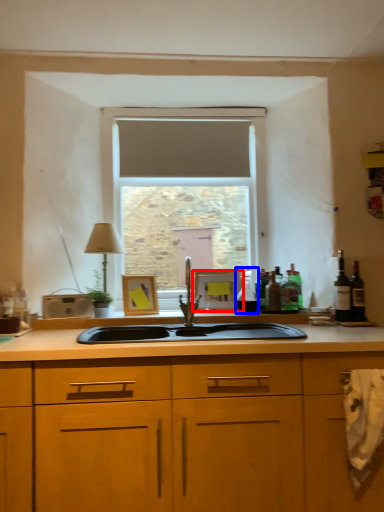
Question: Among these objects, which one is nearest to the camera, picture frame (highlighted by a red box) or bottle (highlighted by a blue box)?

Choices:
 (A) picture frame
 (B) bottle

Answer: (B)